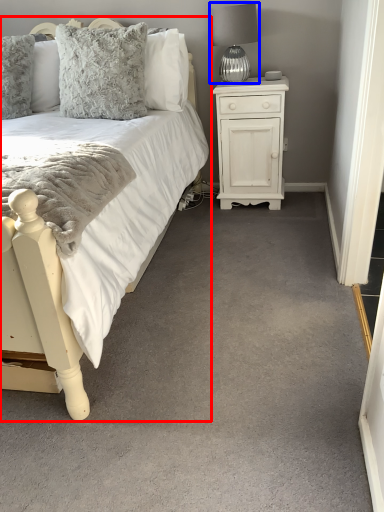
Question: Which of the following is the farthest to the observer, bed (highlighted by a red box) or table lamp (highlighted by a blue box)?

Choices:
 (A) bed
 (B) table lamp

Answer: (B)